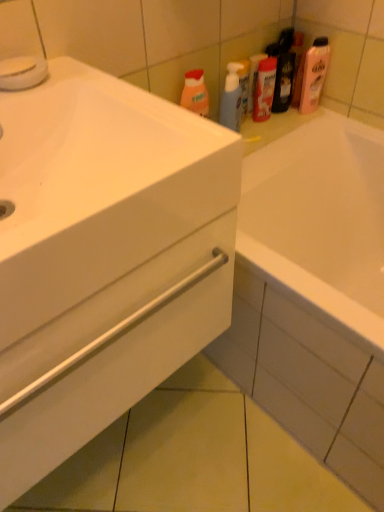
Question: Considering the positions of pink glossy lotion at upper right, placed as the first cleaning product when sorted from right to left, and white glossy cabinet at lower left in the image, is pink glossy lotion at upper right, placed as the first cleaning product when sorted from right to left, bigger or smaller than white glossy cabinet at lower left?

Choices:
 (A) big
 (B) small

Answer: (B)

Question: Choose the correct answer: Is pink glossy lotion at upper right, the second cleaning product positioned from the left, inside white glossy cabinet at lower left or outside it?

Choices:
 (A) inside
 (B) outside

Answer: (B)

Question: Based on their relative distances, which object is farther from the pink glossy lotion at upper right, the second cleaning product positioned from the left?

Choices:
 (A) translucent plastic spray bottle at upper center, which ranks as the 2th cleaning product in right-to-left order
 (B) white glossy cabinet at lower left
 (C) matte plastic mouthwash at upper center

Answer: (B)

Question: Estimate the real-world distances between objects in this image. Which object is closer to the white glossy cabinet at lower left?

Choices:
 (A) pink glossy lotion at upper right, placed as the first cleaning product when sorted from right to left
 (B) matte plastic mouthwash at upper center
 (C) translucent plastic spray bottle at upper center, which is the first cleaning product from left to right

Answer: (C)